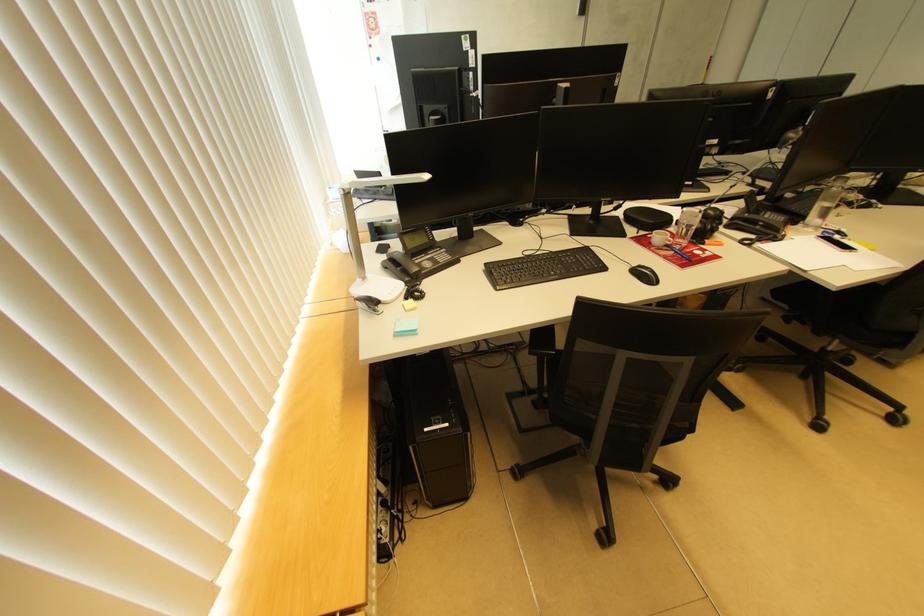
This screenshot has height=616, width=924. In order to click on clear water glass in this screenshot , I will do `click(825, 203)`.